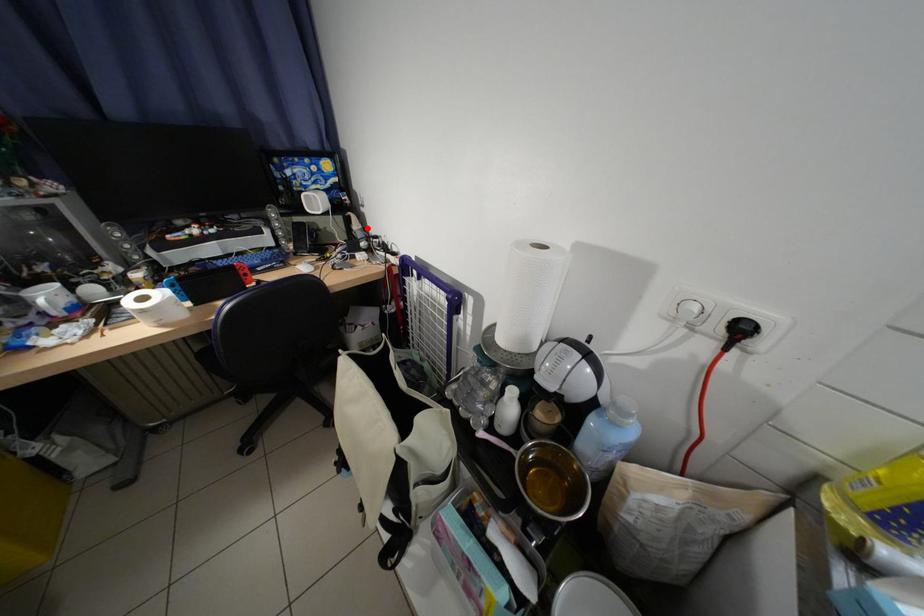
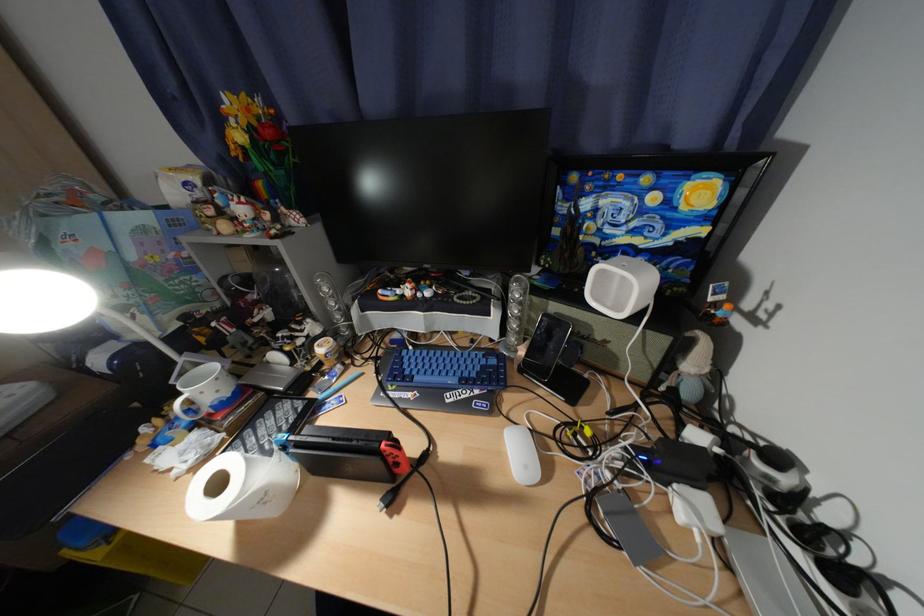
The point at the highlighted location is marked in the first image. Where is the corresponding point in the second image?

(704, 367)